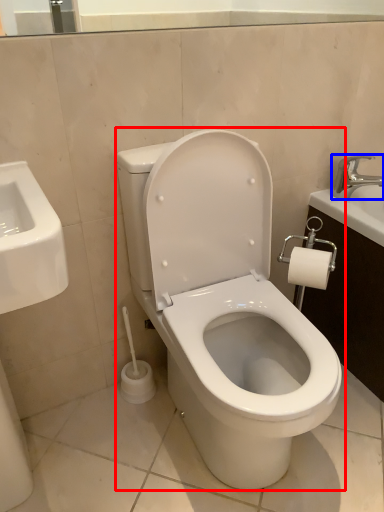
Question: Which point is further to the camera, toilet (highlighted by a red box) or tap (highlighted by a blue box)?

Choices:
 (A) toilet
 (B) tap

Answer: (B)